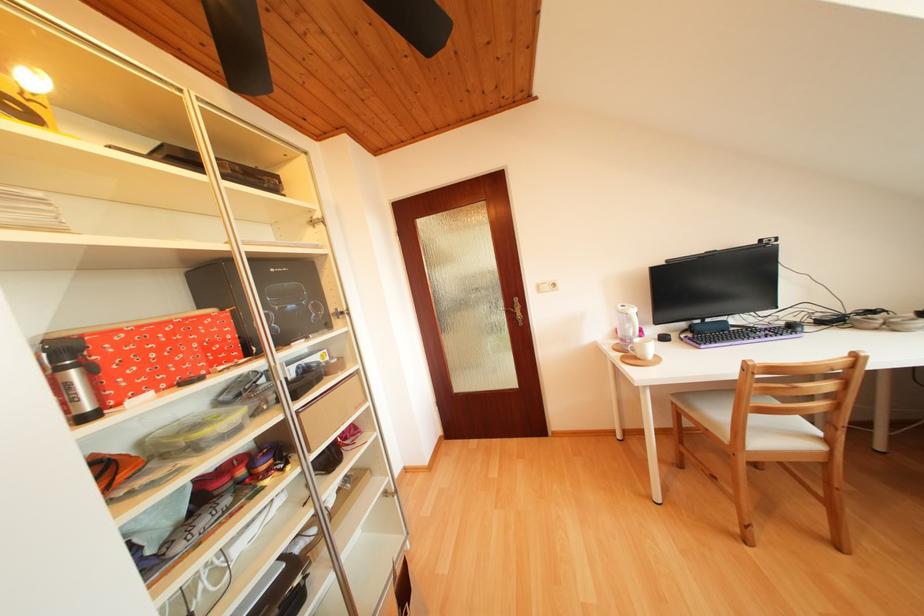
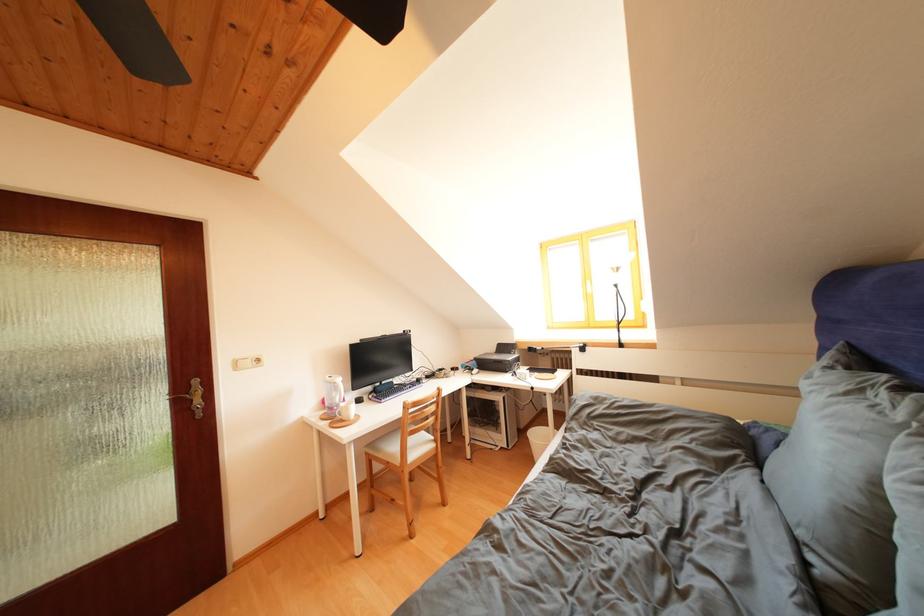
In the second image, find the point that corresponds to pixel 769 246 in the first image.

(411, 337)